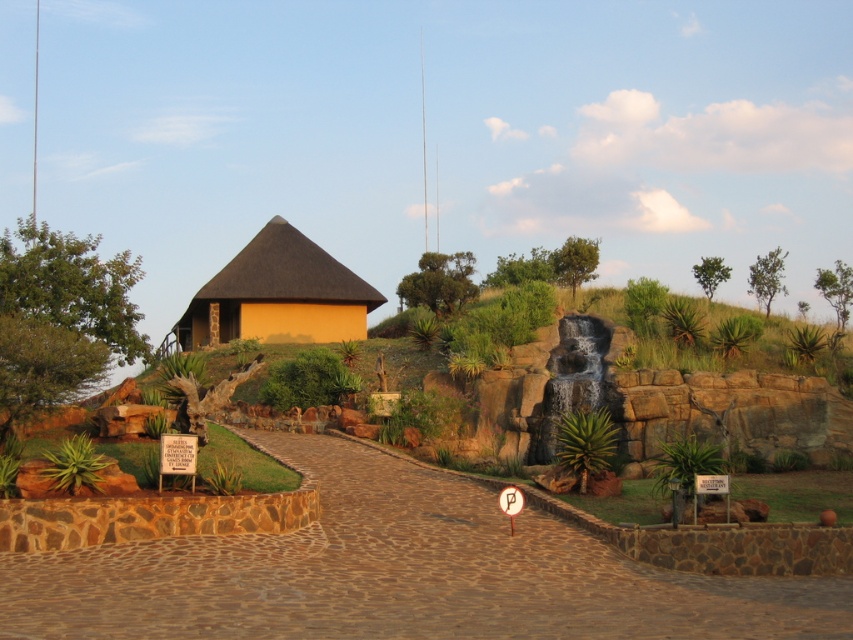
You are planning to build a small garden between the brown cobblestone path at center and the matte yellow thatched hut at center. Which object should you place the garden closer to to ensure it doesn

The brown cobblestone path at center is smaller than the matte yellow thatched hut at center, so placing the garden closer to the brown cobblestone path at center would allow more space around the larger matte yellow thatched hut at center.

You are standing at the bottom of the hill and want to walk up to the entrance of the matte yellow thatched hut at center. The brown cobblestone path at center is in front of you. Considering their heights, which one is closer to your eye level when looking up the path?

The brown cobblestone path at center has a lesser height compared to the matte yellow thatched hut at center, so the path is lower. Therefore, the matte yellow thatched hut at center is closer to your eye level when looking up the path.